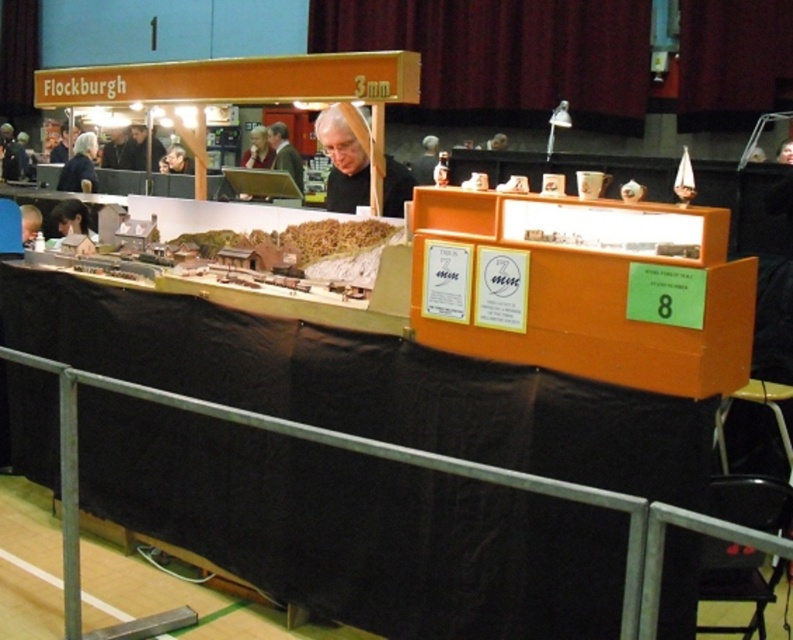
Between white matte hair at center and matte black hair at left, which one is positioned higher?

white matte hair at center is above.

Is white matte hair at center positioned before matte black hair at left?

Yes, it is.

The width and height of the screenshot is (793, 640). Describe the element at coordinates (343, 163) in the screenshot. I see `white matte hair at center` at that location.

You are a GUI agent. You are given a task and a screenshot of the screen. Output one action in this format:
    pyautogui.click(x=<x>, y=<y>)
    Task: Click on the white matte hair at center
    This screenshot has width=793, height=640.
    Given the screenshot: What is the action you would take?
    pyautogui.click(x=343, y=163)

Measure the distance between white matte hair at center and dark brown leather jacket at center.

A distance of 15.72 feet exists between white matte hair at center and dark brown leather jacket at center.

What do you see at coordinates (343, 163) in the screenshot? I see `white matte hair at center` at bounding box center [343, 163].

Find the location of a particular element. white matte hair at center is located at coordinates (343, 163).

From the picture: Is black fabric at left smaller than matte black hair at left?

No, black fabric at left is not smaller than matte black hair at left.

What do you see at coordinates (79, 164) in the screenshot?
I see `black fabric at left` at bounding box center [79, 164].

Between point (83, 157) and point (63, 234), which one is positioned behind?

The point (83, 157) is behind.

Locate an element on the screen. black fabric at left is located at coordinates (79, 164).